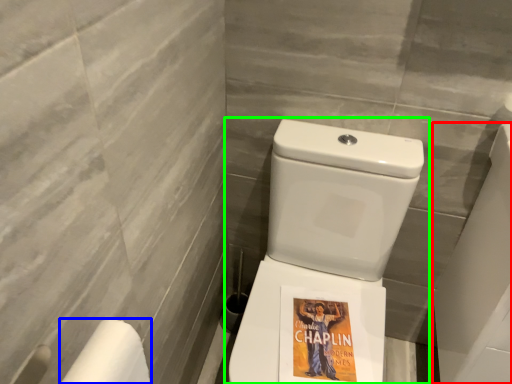
Question: Which object is the farthest from porcelain (highlighted by a red box)? Choose among these: toilet paper (highlighted by a blue box) or toilet (highlighted by a green box).

Choices:
 (A) toilet paper
 (B) toilet

Answer: (A)